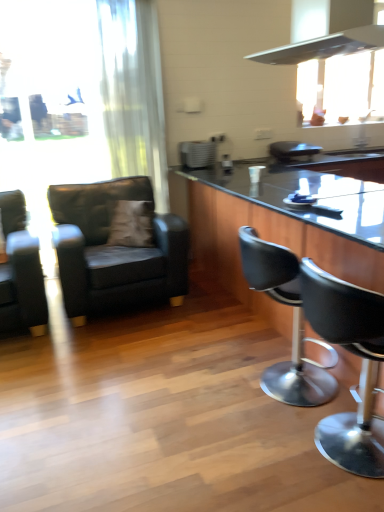
At what (x,y) coordinates should I click in order to perform the action: click on vacant area that is in front of matte black armchair at left, marked as the 3th chair in a right-to-left arrangement. Please return your answer as a coordinate pair (x, y). Looking at the image, I should click on (121, 358).